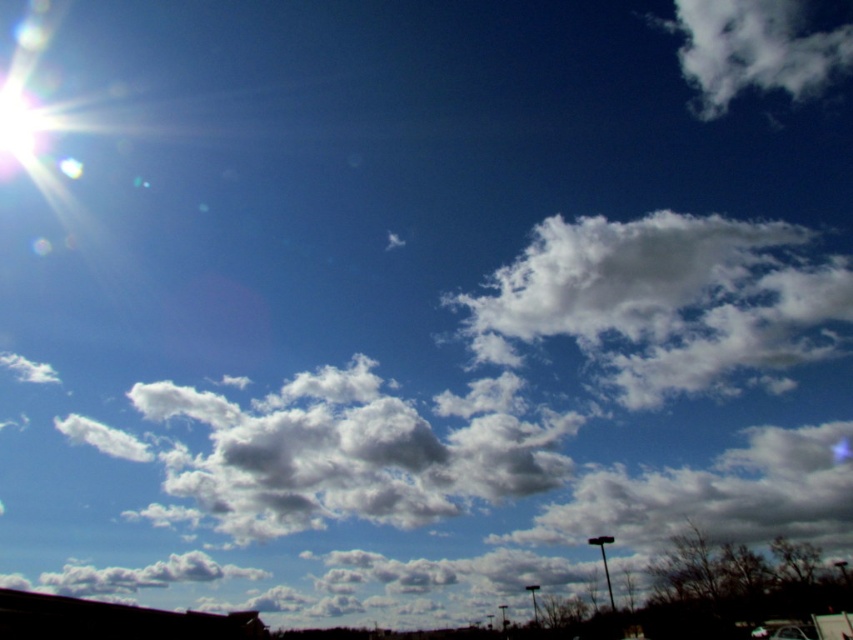
Between white fluffy cloud at upper center and white fluffy cloud at upper right, which one has less height?

white fluffy cloud at upper center is shorter.

Is white fluffy cloud at upper center below white fluffy cloud at upper right?

Indeed, white fluffy cloud at upper center is positioned under white fluffy cloud at upper right.

Where is `white fluffy cloud at upper center`? This screenshot has width=853, height=640. white fluffy cloud at upper center is located at coordinates (618, 276).

Where is `white fluffy cloud at upper center`? The width and height of the screenshot is (853, 640). white fluffy cloud at upper center is located at coordinates (618, 276).

Who is positioned more to the right, white fluffy cloud at upper center or metallic silver car at bottom right?

white fluffy cloud at upper center

Is the position of white fluffy cloud at upper center less distant than that of metallic silver car at bottom right?

That is False.

The height and width of the screenshot is (640, 853). I want to click on white fluffy cloud at upper center, so click(x=618, y=276).

Between point (776, 3) and point (804, 637), which one is positioned behind?

Positioned behind is point (776, 3).

Measure the distance between point (799, 28) and camera.

A distance of 138.75 meters exists between point (799, 28) and camera.

Identify the location of white fluffy cloud at upper right. (753, 51).